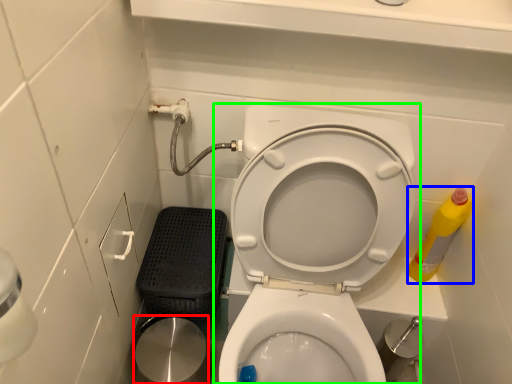
Question: Considering the real-world distances, which object is closest to potty (highlighted by a red box)? cleaning product (highlighted by a blue box) or toilet (highlighted by a green box).

Choices:
 (A) cleaning product
 (B) toilet

Answer: (B)